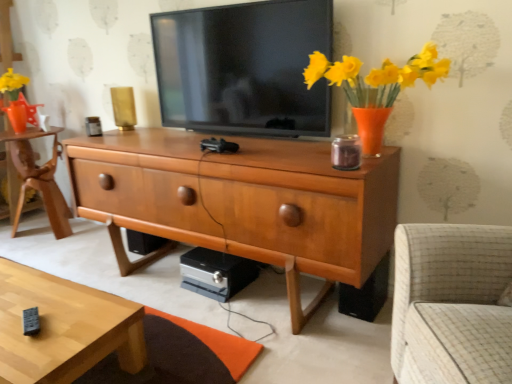
Question: Is light brown wooden desk at left spatially inside matte black tv at center, or outside of it?

Choices:
 (A) inside
 (B) outside

Answer: (B)

Question: Based on their positions, is light brown wooden desk at left located to the left or right of matte black tv at center?

Choices:
 (A) right
 (B) left

Answer: (B)

Question: Which object is the closest to the light wood/texture coffee table at lower left?

Choices:
 (A) matte black tv at center
 (B) wooden chest of drawers at center
 (C) black plastic speaker at lower right
 (D) light brown wooden desk at left

Answer: (B)

Question: Which object is the farthest from the matte black tv at center?

Choices:
 (A) black plastic speaker at lower right
 (B) light brown wooden desk at left
 (C) light wood/texture coffee table at lower left
 (D) wooden chest of drawers at center

Answer: (B)